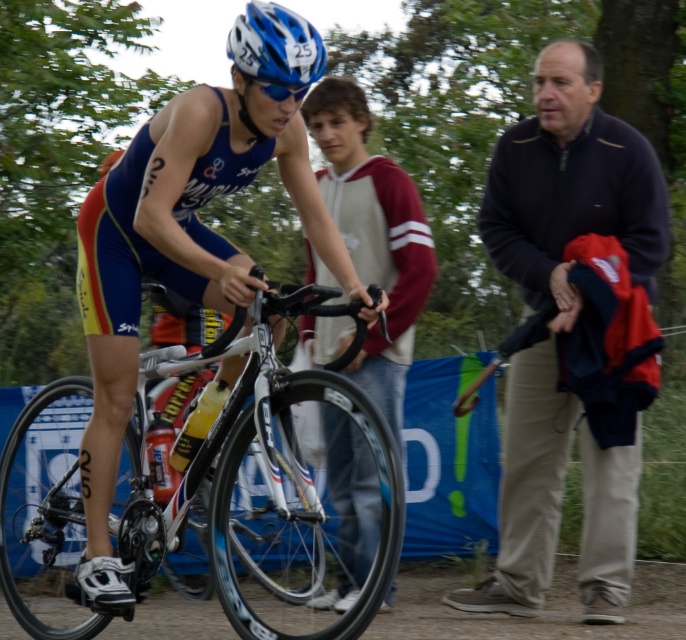
You are a photographer standing at the edge of the transition area. You need to capture a photo of the white glossy bicycle at center and the blue matte helmet at upper center. Can you frame both objects in the same shot without moving either object?

The white glossy bicycle at center is positioned under the blue matte helmet at upper center, so yes, both objects can be framed in the same shot as they are aligned vertically.

You are a photographer positioned at the edge of the transition area. You need to capture a photo of the white glossy bicycle at center and the blue matte helmet at upper center. Based on their positions, which object should you adjust your camera focus to first to ensure both are in frame?

The blue matte helmet at upper center should be focused first since the white glossy bicycle at center is to the right of it, allowing you to adjust the camera to include both in the frame by panning slightly to the right.